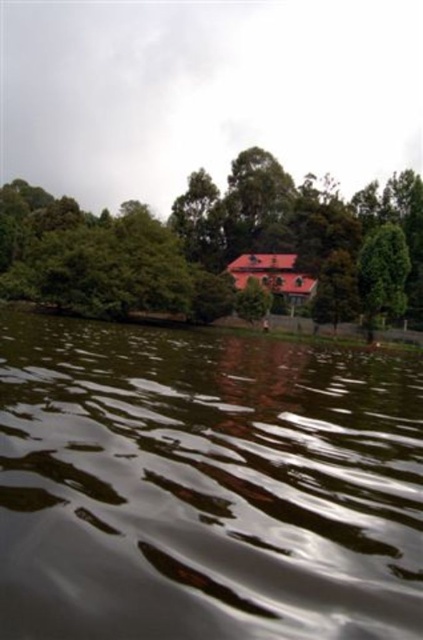
You are standing at the edge of the lake and want to walk to the building with the red roof. There is a dark reflective water at center and a green leafy tree at upper center in your way. Which object is closer to you that you need to navigate around first?

The dark reflective water at center is closer to you than the green leafy tree at upper center, so you need to navigate around it first.

You are standing at the edge of the lake and notice the dark reflective water at center and the green leafy tree at upper center. Which of these two objects occupies a wider area in the scene?

The green leafy tree at upper center occupies a wider area in the scene since the dark reflective water at center has a smaller width compared to it.

You are standing at the origin point in the scene. Can you tell me the 2D coordinates of the dark reflective water at center?

The 2D coordinates of the dark reflective water at center are at point [205,486].